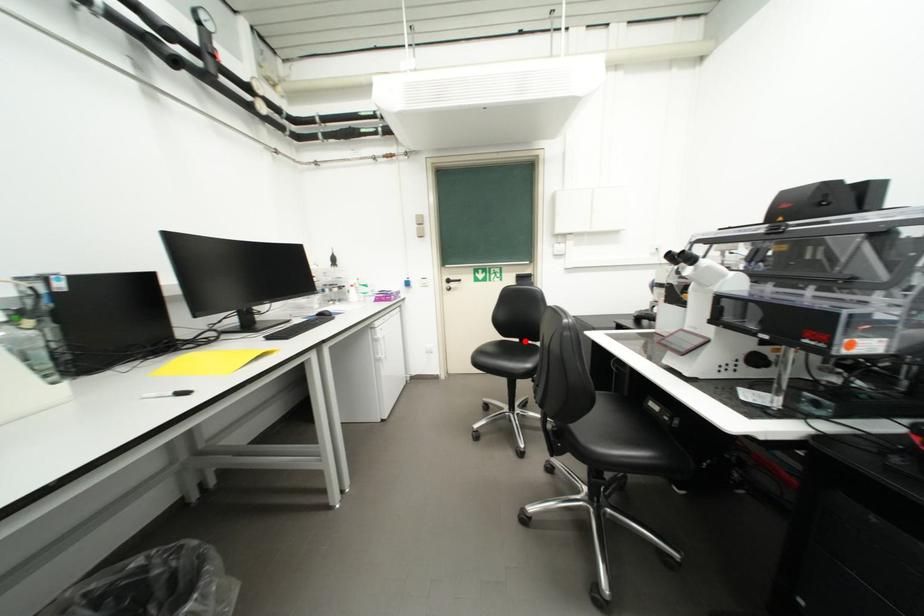
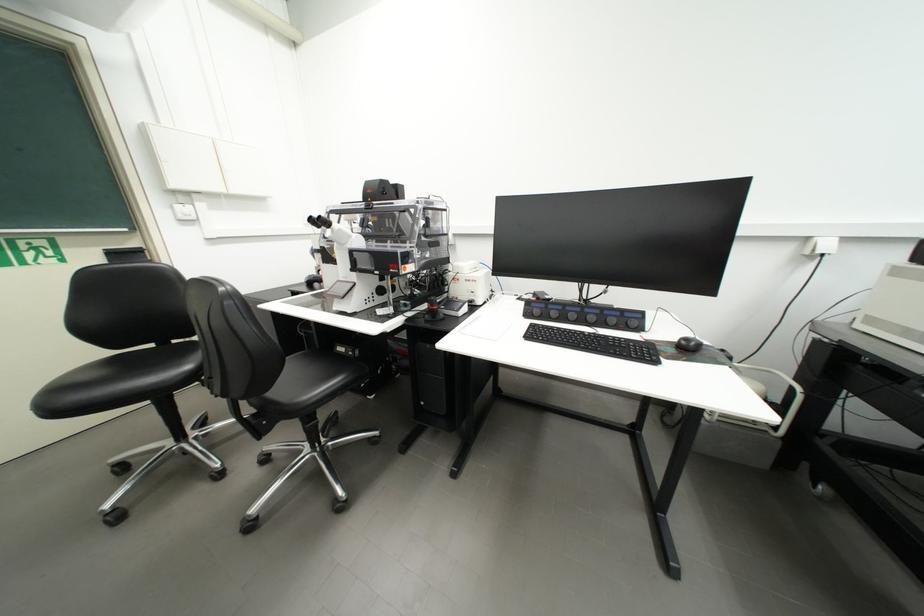
Where in the second image is the point corresponding to the highlighted location from the first image?

(160, 347)